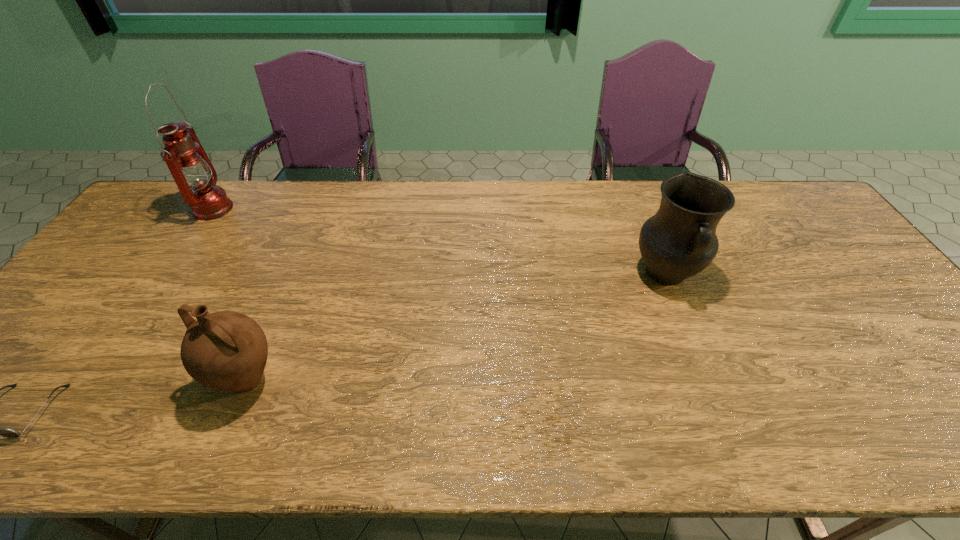
Where is `the tallest object`? the tallest object is located at coordinates (192, 170).

This screenshot has width=960, height=540. In order to click on oil lamp in this screenshot , I will do `click(192, 170)`.

Find the location of `the rightmost object`. the rightmost object is located at coordinates (679, 241).

You are a GUI agent. You are given a task and a screenshot of the screen. Output one action in this format:
    pyautogui.click(x=<x>, y=<y>)
    Task: Click on the second farthest object
    
    Given the screenshot: What is the action you would take?
    pyautogui.click(x=679, y=241)

You are a GUI agent. You are given a task and a screenshot of the screen. Output one action in this format:
    pyautogui.click(x=<x>, y=<y>)
    Task: Click on the second object from right to left
    This screenshot has height=540, width=960.
    Given the screenshot: What is the action you would take?
    pyautogui.click(x=226, y=350)

The width and height of the screenshot is (960, 540). I want to click on the nearer pitcher, so click(x=226, y=350).

You are a GUI agent. You are given a task and a screenshot of the screen. Output one action in this format:
    pyautogui.click(x=<x>, y=<y>)
    Task: Click on the vacant region located on the right of the farthest object
    
    Given the screenshot: What is the action you would take?
    pyautogui.click(x=280, y=210)

In order to click on free space located 0.310m on the handle side of the rightmost object in this screenshot , I will do `click(722, 411)`.

Identify the location of vacant space located 0.180m on the right of the nearer pitcher. The width and height of the screenshot is (960, 540). (361, 381).

The height and width of the screenshot is (540, 960). What are the coordinates of `object present at the far edge` in the screenshot? It's located at (192, 170).